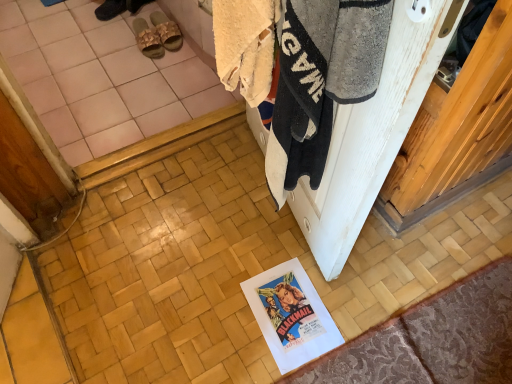
Question: In the image, is patterned fabric doormat at lower right positioned in front of or behind dark brown leather sandals at upper center, which is the 1th footwear in left-to-right order?

Choices:
 (A) behind
 (B) front

Answer: (B)

Question: Looking at the image, does patterned fabric doormat at lower right seem bigger or smaller compared to dark brown leather sandals at upper center, which is the 1th footwear in left-to-right order?

Choices:
 (A) big
 (B) small

Answer: (A)

Question: Which object is the farthest from the beige fabric slipper at upper left, which ranks as the second footwear in right-to-left order?

Choices:
 (A) patterned fabric doormat at lower right
 (B) white fluffy towel at upper right
 (C) beige woven slipper at upper left, the 1th footwear in the right-to-left sequence
 (D) white wood screen door at upper right
 (E) white paper at lower center

Answer: (A)

Question: Which object is the closest to the white fluffy towel at upper right?

Choices:
 (A) dark brown leather sandals at upper center, which is the 1th footwear in left-to-right order
 (B) white paper at lower center
 (C) beige fabric slipper at upper left, which ranks as the second footwear in right-to-left order
 (D) beige woven slipper at upper left, acting as the third footwear starting from the left
 (E) white wood screen door at upper right

Answer: (E)